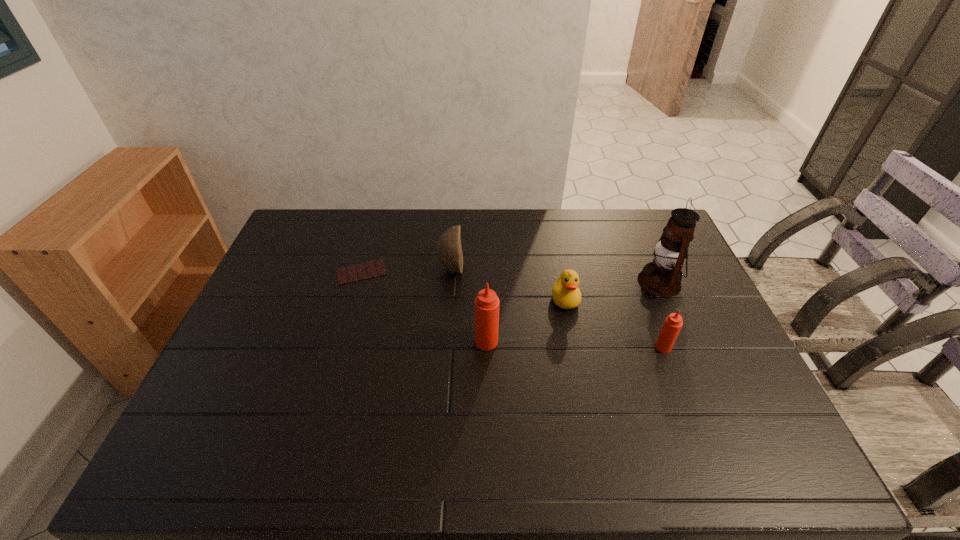
Observe the arrangement of all Tabasco sauces in the image. To keep them evenly spaced, where would you place another Tabasco sauce on the left? Please locate a free space. Please provide its 2D coordinates. Your answer should be formatted as a tuple, i.e. [(x, y)], where the tuple contains the x and y coordinates of a point satisfying the conditions above.

[(314, 336)]